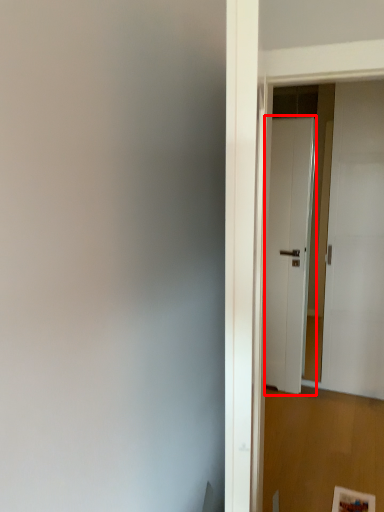
Question: From the image's perspective, what is the correct spatial positioning of door (annotated by the red box) in reference to door?

Choices:
 (A) above
 (B) below

Answer: (B)